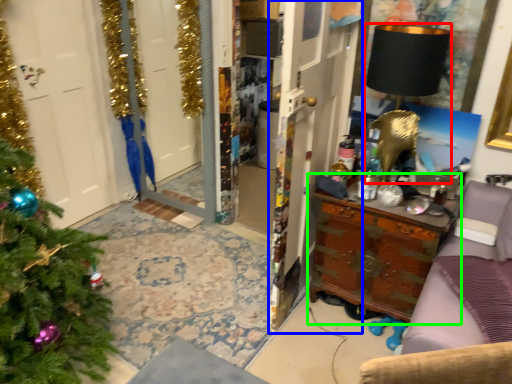
Question: Which object is positioned closest to lamp (highlighted by a red box)? Select from armoire (highlighted by a blue box) and table (highlighted by a green box).

Choices:
 (A) armoire
 (B) table

Answer: (A)